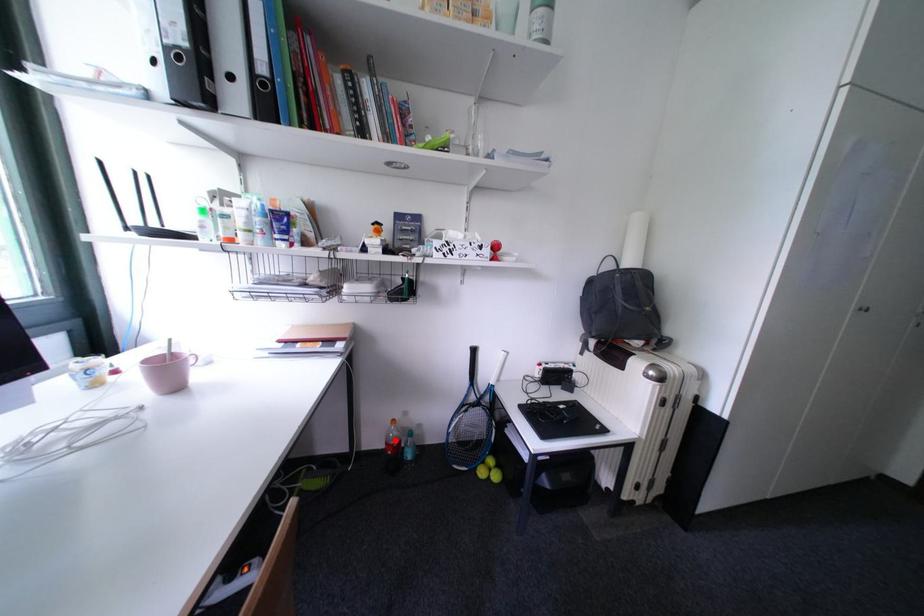
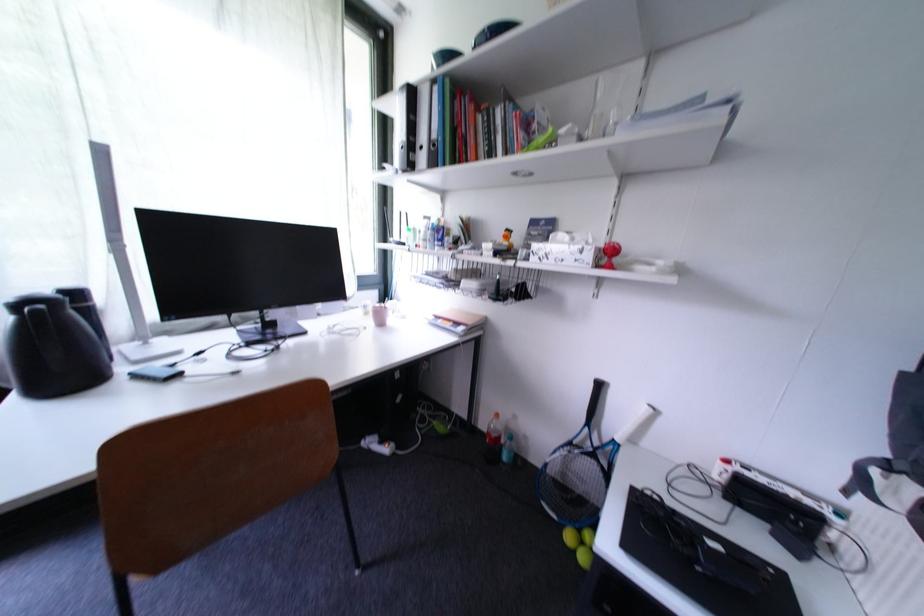
Where in the second image is the point corresponding to the highlighted location from the first image?

(497, 429)